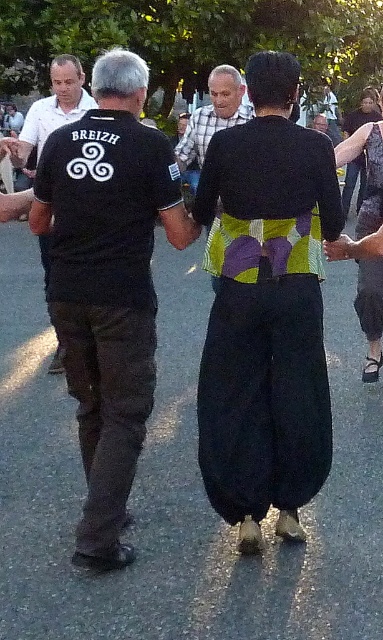
Question: Based on their relative distances, which object is farther from the black cotton t-shirt at left?

Choices:
 (A) black cotton shirt at center
 (B) camouflage fabric dress at center
 (C) green and purple fabric skirt at center

Answer: (B)

Question: Is black cotton shirt at center bigger than camouflage fabric dress at center?

Choices:
 (A) no
 (B) yes

Answer: (B)

Question: Can you confirm if green textured skirt at center is positioned below camouflage fabric dress at center?

Choices:
 (A) yes
 (B) no

Answer: (A)

Question: Estimate the real-world distances between objects in this image. Which object is farther from the black cotton shirt at center?

Choices:
 (A) black cotton pants at center
 (B) camouflage fabric dress at center
 (C) green and purple fabric skirt at center

Answer: (B)

Question: Does black cotton pants at center have a larger size compared to camouflage fabric dress at center?

Choices:
 (A) yes
 (B) no

Answer: (A)

Question: Among these points, which one is farthest from the camera?

Choices:
 (A) (376, 324)
 (B) (369, 150)

Answer: (A)